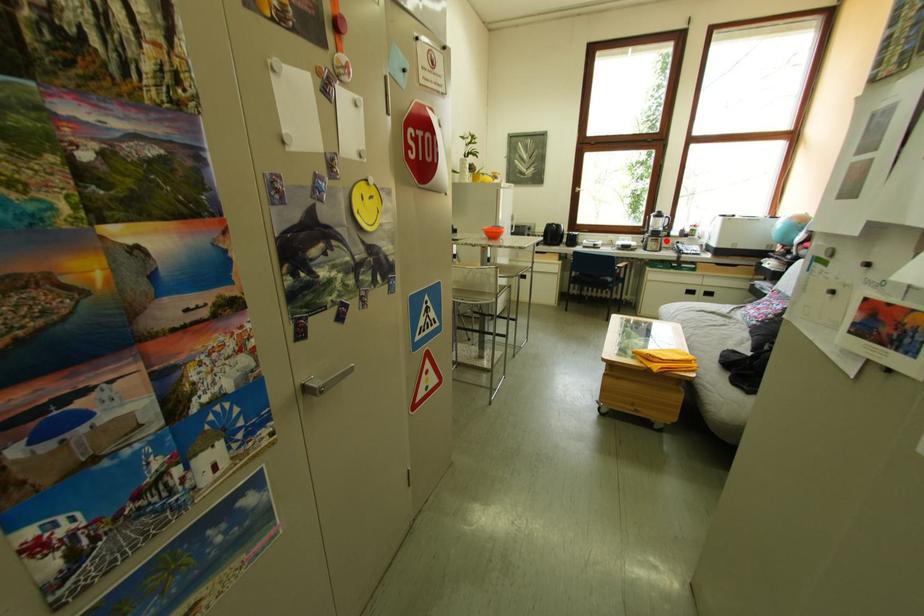
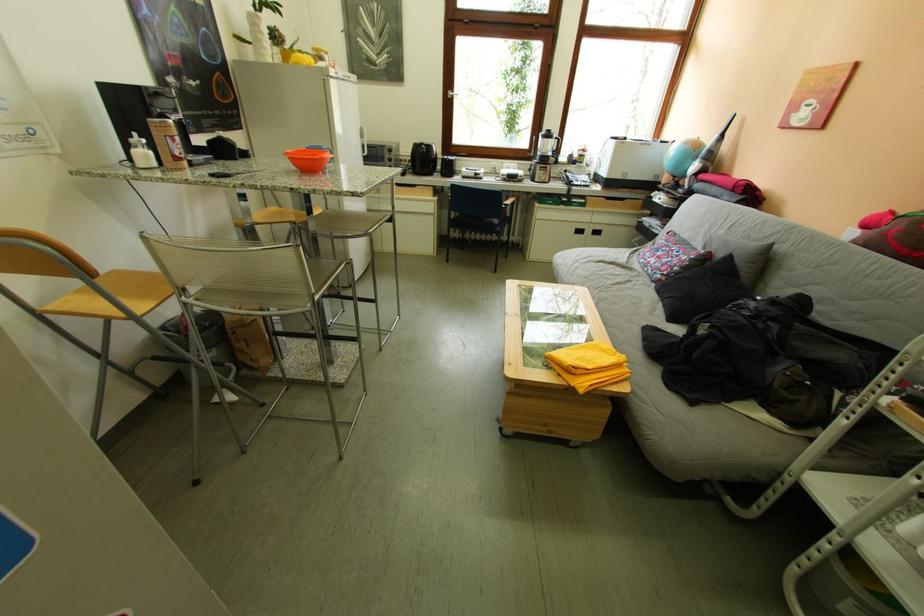
Find the pixel in the second image that matches the highlighted location in the first image.

(554, 169)